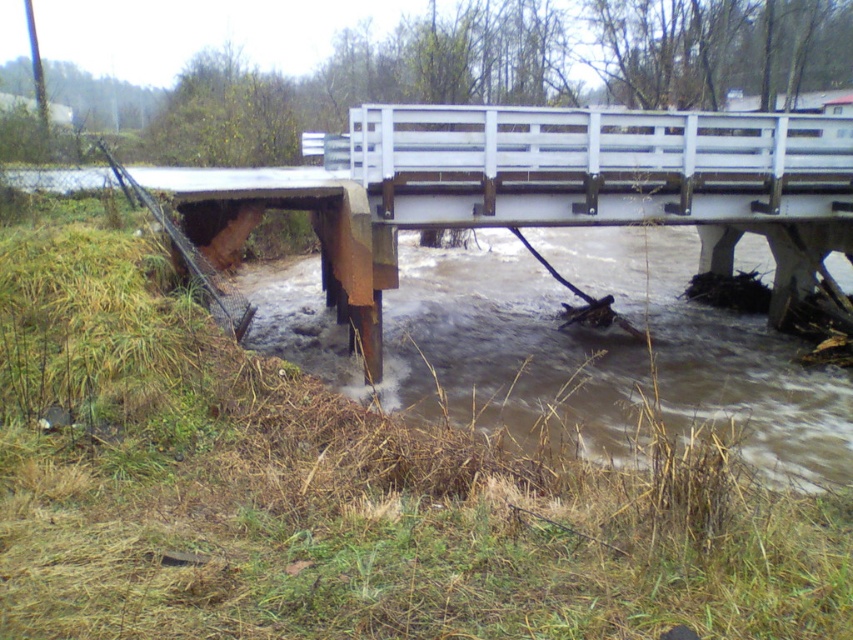
You are a civil engineer inspecting a bridge. You notice the rusty metal bridge at left. Where exactly is it located in the image coordinates?

The rusty metal bridge at left is located at coordinates point (534, 189).

You are a rescue worker needing to cross the river to reach survivors on the other side. You see the rusty metal bridge at left and the brown muddy water at lower center. Which path would be safer to cross?

The brown muddy water at lower center is safer to cross because the rusty metal bridge at left is positioned to its left and has collapsed, making it unstable.

You are a rescue worker trying to cross a damaged bridge to reach a stranded vehicle on the other side. The bridge has a point labeled as point (534, 189). Based on the scene description, is this point located on a safe or unsafe section of the bridge?

The point (534, 189) is on the rusty metal bridge at left, which has collapsed into the river and shows deteriorated supports. This section is unsafe for crossing.